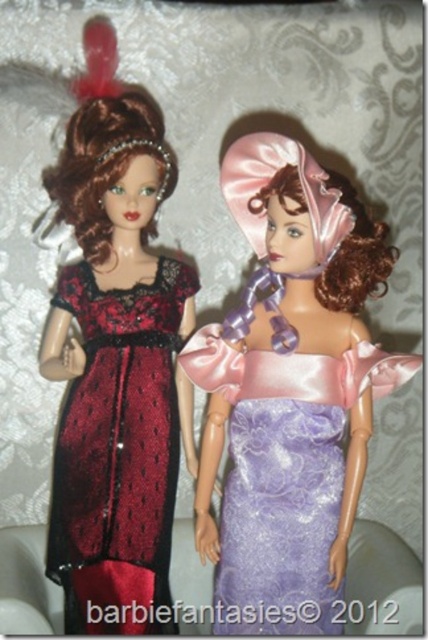
Between lavender satin dress at center and matte lace dress at left, which one appears on the left side from the viewer's perspective?

From the viewer's perspective, matte lace dress at left appears more on the left side.

Which is more to the right, lavender satin dress at center or matte lace dress at left?

From the viewer's perspective, lavender satin dress at center appears more on the right side.

The width and height of the screenshot is (428, 640). Find the location of `lavender satin dress at center`. lavender satin dress at center is located at coordinates (290, 392).

Where is `lavender satin dress at center`? Image resolution: width=428 pixels, height=640 pixels. lavender satin dress at center is located at coordinates (290, 392).